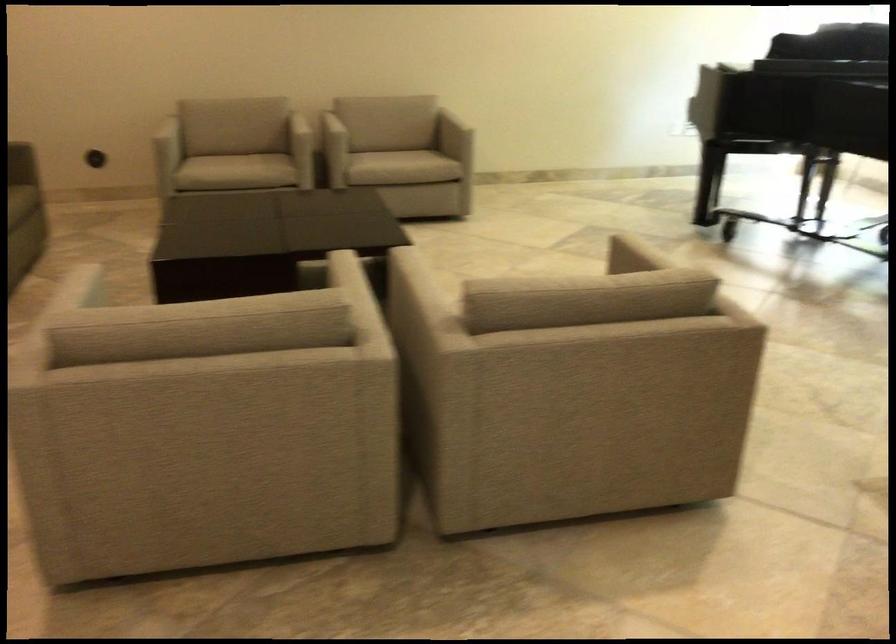
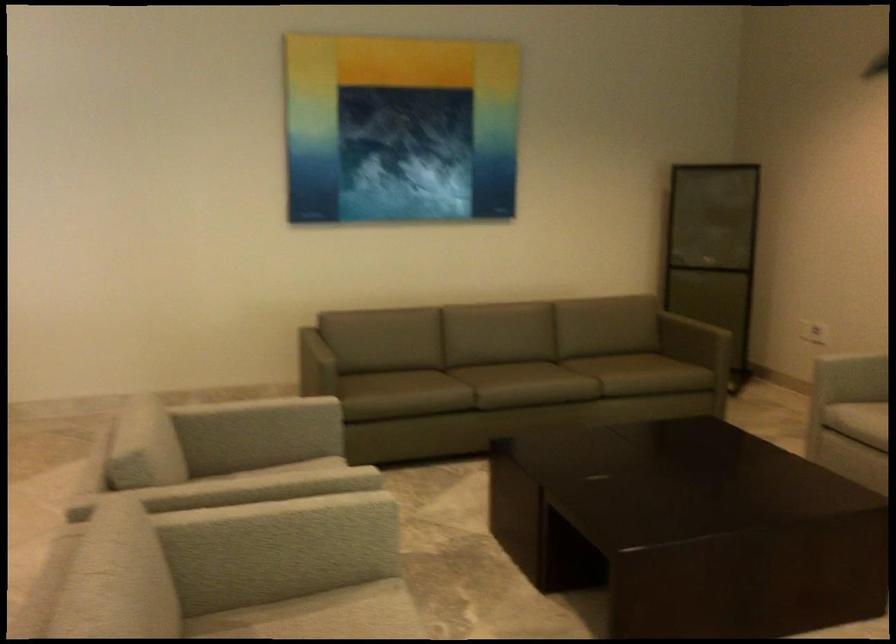
Locate, in the second image, the point that corresponds to [419,277] in the first image.

(289, 529)